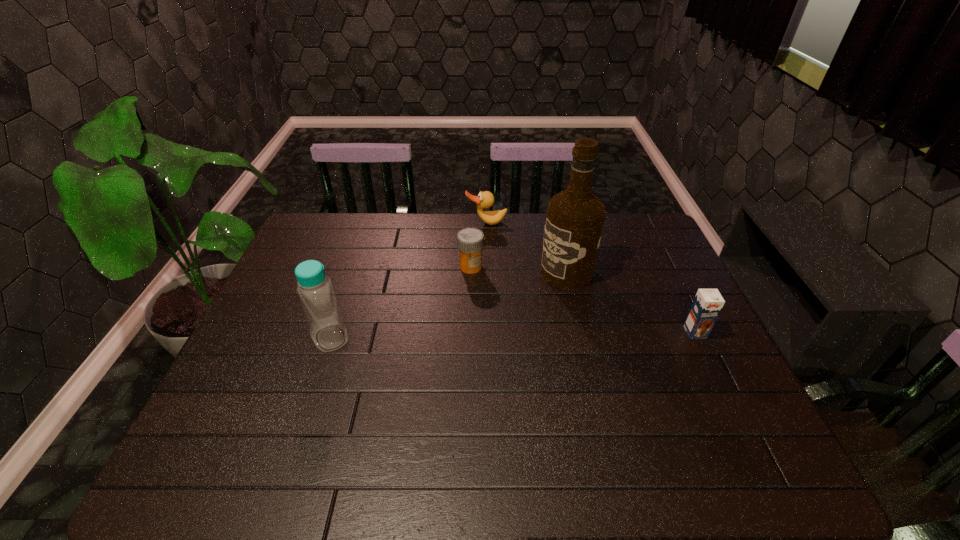
Where is `vacant space that's between the tallest object and the medicine`? vacant space that's between the tallest object and the medicine is located at coordinates (518, 269).

At what (x,y) coordinates should I click in order to perform the action: click on vacant point located between the fourth shortest object and the rightmost object. Please return your answer as a coordinate pair (x, y). This screenshot has width=960, height=540. Looking at the image, I should click on click(513, 335).

The image size is (960, 540). What are the coordinates of `free space between the second tallest object and the second object from right to left` in the screenshot? It's located at (448, 305).

This screenshot has width=960, height=540. I want to click on free space between the chocolate milk and the tallest object, so click(631, 302).

The width and height of the screenshot is (960, 540). I want to click on blank region between the duck and the second object from right to left, so click(526, 247).

Locate an element on the screen. object identified as the fourth closest to the alcohol is located at coordinates (315, 290).

This screenshot has height=540, width=960. I want to click on object that is the second closest to the tallest object, so click(485, 199).

Find the location of a particular element. blank space that satisfies the following two spatial constraints: 1. on the front side of the farthest object; 2. on the left side of the alcohol is located at coordinates (488, 272).

Locate an element on the screen. This screenshot has width=960, height=540. free location that satisfies the following two spatial constraints: 1. on the back side of the second object from right to left; 2. on the right side of the leftmost object is located at coordinates (x=353, y=272).

Where is `vacant region that satisfies the following two spatial constraints: 1. on the back side of the duck; 2. on the left side of the medicine`? This screenshot has height=540, width=960. vacant region that satisfies the following two spatial constraints: 1. on the back side of the duck; 2. on the left side of the medicine is located at coordinates (472, 223).